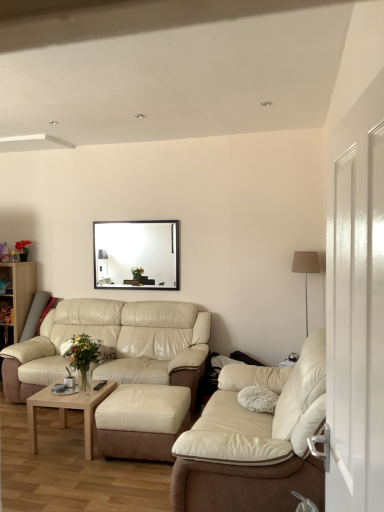
Question: From the image's perspective, is beige leather couch at lower left, the first studio couch positioned from the back, under wooden bookshelf at left?

Choices:
 (A) no
 (B) yes

Answer: (B)

Question: Is beige leather couch at lower left, marked as the first studio couch in a left-to-right arrangement, smaller than wooden bookshelf at left?

Choices:
 (A) yes
 (B) no

Answer: (B)

Question: Is beige leather couch at lower left, the first studio couch positioned from the back, shorter than wooden bookshelf at left?

Choices:
 (A) no
 (B) yes

Answer: (B)

Question: Is beige leather couch at lower left, marked as the first studio couch in a left-to-right arrangement, taller than wooden bookshelf at left?

Choices:
 (A) no
 (B) yes

Answer: (A)

Question: Is beige leather couch at lower left, the first studio couch positioned from the back, aimed at wooden bookshelf at left?

Choices:
 (A) no
 (B) yes

Answer: (A)

Question: Is white glossy door at right in front of or behind light brown wooden coffee table at lower left in the image?

Choices:
 (A) behind
 (B) front

Answer: (B)

Question: Is white glossy door at right taller or shorter than light brown wooden coffee table at lower left?

Choices:
 (A) tall
 (B) short

Answer: (A)

Question: Considering the positions of white glossy door at right and light brown wooden coffee table at lower left in the image, is white glossy door at right wider or thinner than light brown wooden coffee table at lower left?

Choices:
 (A) wide
 (B) thin

Answer: (B)

Question: Considering the positions of point (367, 499) and point (61, 425), is point (367, 499) closer or farther from the camera than point (61, 425)?

Choices:
 (A) farther
 (B) closer

Answer: (B)

Question: From the image's perspective, is black glossy picture frame at upper center above or below light brown wooden coffee table at lower left?

Choices:
 (A) below
 (B) above

Answer: (B)

Question: Does point (175, 237) appear closer or farther from the camera than point (41, 397)?

Choices:
 (A) farther
 (B) closer

Answer: (A)

Question: Is black glossy picture frame at upper center taller or shorter than light brown wooden coffee table at lower left?

Choices:
 (A) short
 (B) tall

Answer: (B)

Question: Is black glossy picture frame at upper center inside or outside of light brown wooden coffee table at lower left?

Choices:
 (A) inside
 (B) outside

Answer: (B)

Question: Is silver metallic floor lamp at right taller or shorter than suede ottoman at center?

Choices:
 (A) tall
 (B) short

Answer: (A)

Question: Is silver metallic floor lamp at right in front of or behind suede ottoman at center in the image?

Choices:
 (A) front
 (B) behind

Answer: (B)